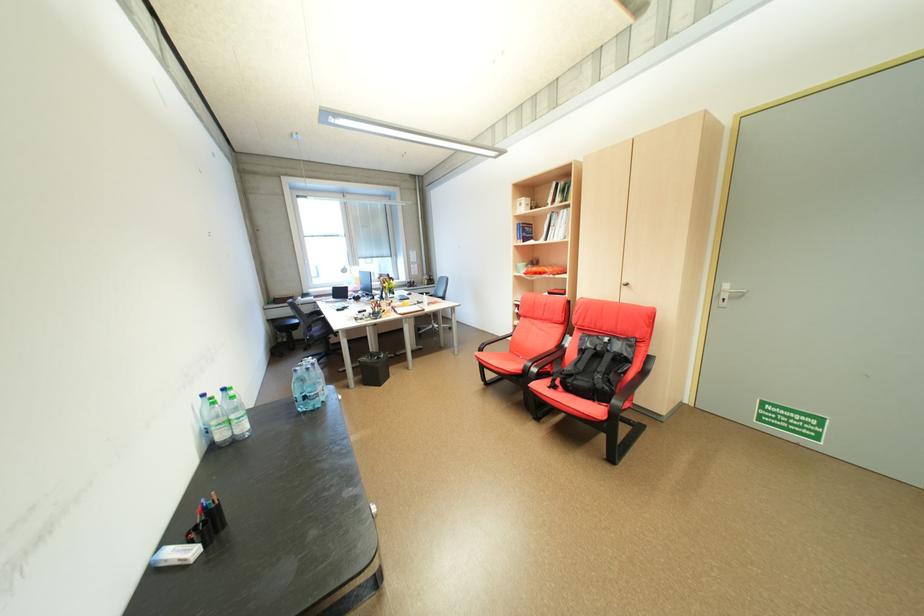
Describe the element at coordinates (506, 357) in the screenshot. I see `a red chair sitting surface` at that location.